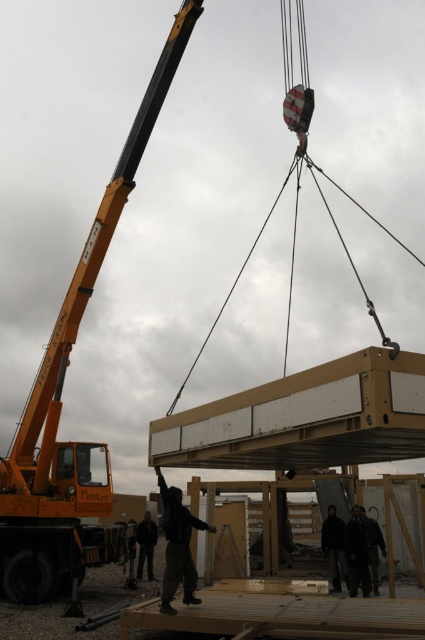
Question: Estimate the real-world distances between objects in this image. Which object is farther from the black matte clothing at center?

Choices:
 (A) black fabric at lower center
 (B) black fabric person at center

Answer: (B)

Question: Which point is farther to the camera?

Choices:
 (A) (161, 486)
 (B) (342, 564)
 (C) (147, 524)

Answer: (C)

Question: Is black matte clothing at center behind black fabric person at center?

Choices:
 (A) yes
 (B) no

Answer: (B)

Question: Is black fabric at lower center to the right of black fabric person at center from the viewer's perspective?

Choices:
 (A) no
 (B) yes

Answer: (B)

Question: Which object is closer to the camera taking this photo?

Choices:
 (A) black fabric at lower center
 (B) black matte clothing at center

Answer: (B)

Question: Can you confirm if black matte clothing at center is smaller than black fabric person at center?

Choices:
 (A) yes
 (B) no

Answer: (B)